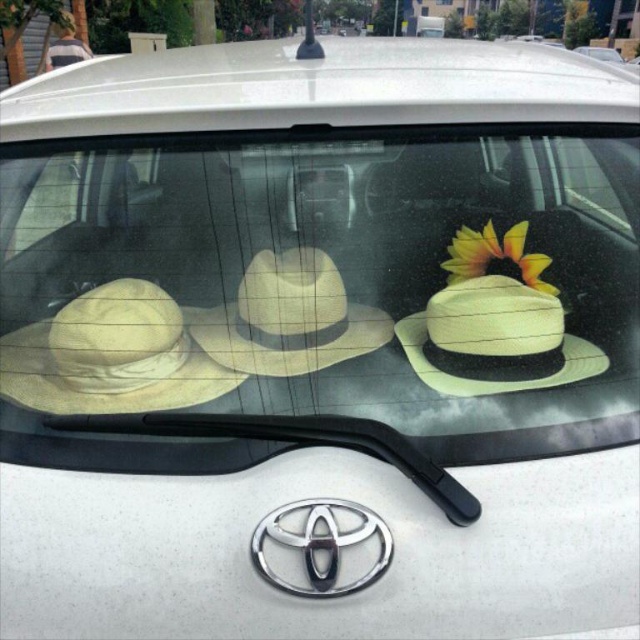
You are a driver looking at the windshield of your white Toyota. You notice two items reflected on the windshield. The beige straw hat at center and the yellow matte flower at upper right. Which one appears closer to you?

The beige straw hat at center appears closer to you because it is closer to the viewer than the yellow matte flower at upper right according to the description.